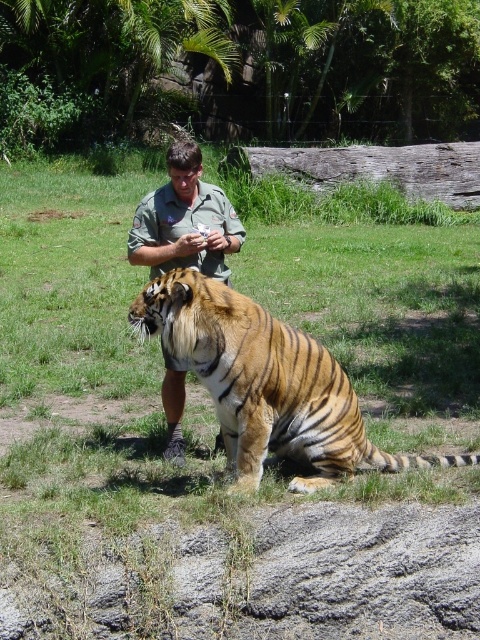
Based on the photo, you are a zookeeper who needs to ensure there is enough space between the orange striped tiger at center and the green uniform at center to safely move around. Based on their sizes, can you estimate if there is sufficient space between them?

The orange striped tiger at center might be wider than green uniform at center, so there may not be enough space between them for safe movement. The zookeeper should maintain a greater distance.

You are a zookeeper who needs to feed the tiger. The safety guidelines state that you must maintain a minimum distance of 1.5 meters between yourself and the tiger at all times. Given the current distance between the orange striped tiger at center and the green uniform at center, can you safely approach the tiger to feed it?

The current distance between the orange striped tiger at center and the green uniform at center is 1.52 meters, which meets the safety guideline requirement of 1.5 meters. Therefore, you can safely approach the tiger to feed it while maintaining the required distance.

You are a visitor at the zoo and want to take a photo of the orange striped tiger at center without the green uniform at center appearing in the shot. How can you adjust your position to achieve this?

The orange striped tiger at center is in front of the green uniform at center. To avoid capturing the green uniform at center in your photo, move slightly to the side so that the orange striped tiger at center blocks the view of the green uniform at center.